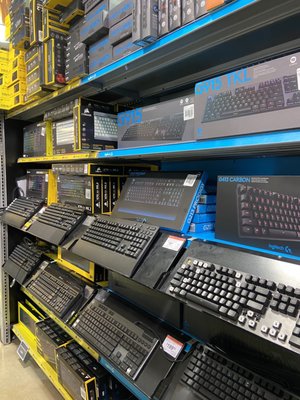
Image resolution: width=300 pixels, height=400 pixels. What are the coordinates of `light yellow edge on shelf` in the screenshot? It's located at pos(59,323).